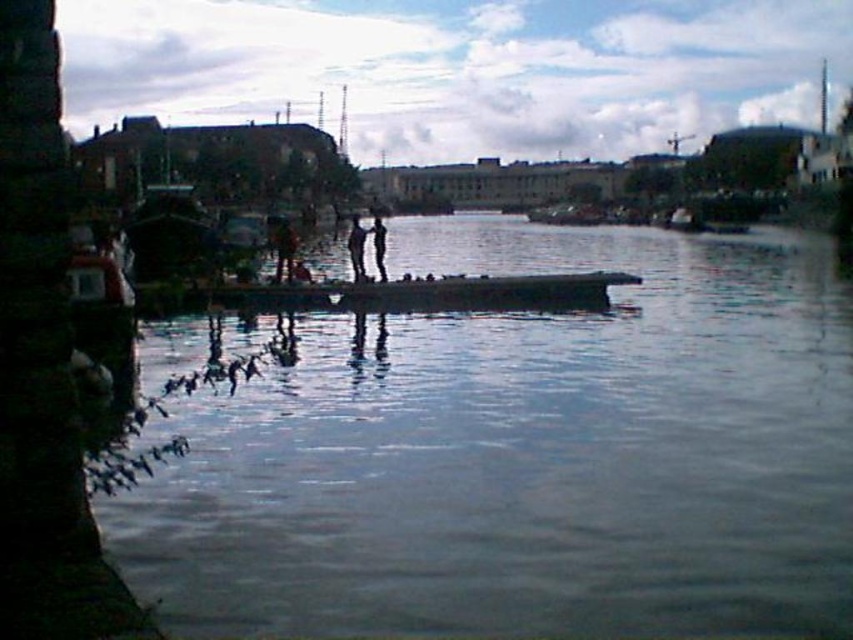
Who is positioned more to the right, smooth concrete dock at center or smooth black figure at center?

smooth concrete dock at center

Is point (575, 433) in front of point (352, 280)?

Yes, it is.

Who is more distant from viewer, (674, 349) or (349, 252)?

Positioned behind is point (349, 252).

Find the location of a particular element. smooth concrete dock at center is located at coordinates (525, 454).

Who is lower down, smooth black figure at center or black matte person at center?

smooth black figure at center is lower down.

Between point (358, 262) and point (381, 246), which one is positioned in front?

Point (381, 246)

Measure the distance between smooth black figure at center and camera.

22.03 meters

Where is `smooth black figure at center`? The image size is (853, 640). smooth black figure at center is located at coordinates (357, 248).

In order to click on smooth concrete dock at center in this screenshot , I will do `click(525, 454)`.

Does smooth concrete dock at center have a lesser width compared to black matte person at center?

Incorrect, smooth concrete dock at center's width is not less than black matte person at center's.

Is point (605, 566) less distant than point (372, 234)?

Yes, point (605, 566) is closer to viewer.

Locate an element on the screen. smooth concrete dock at center is located at coordinates (525, 454).